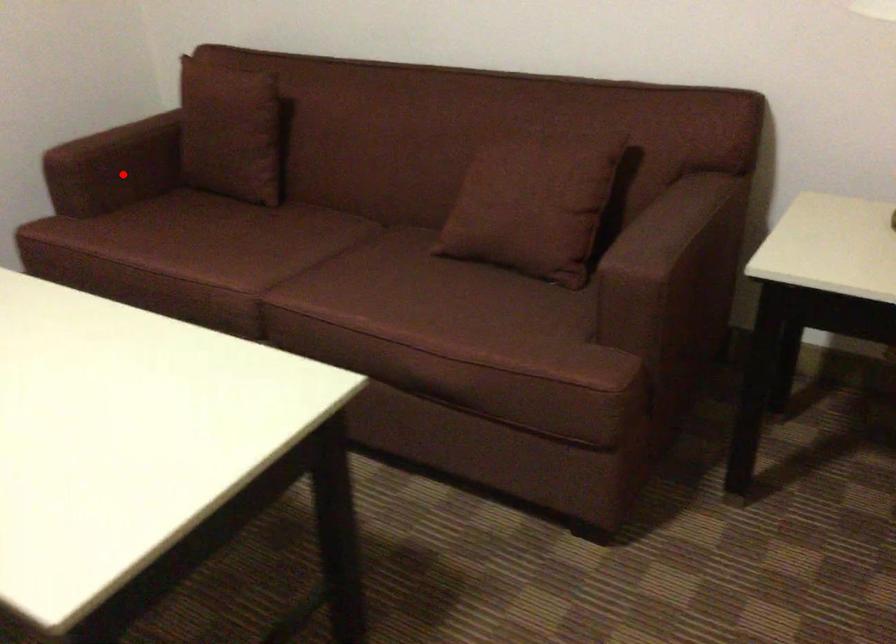
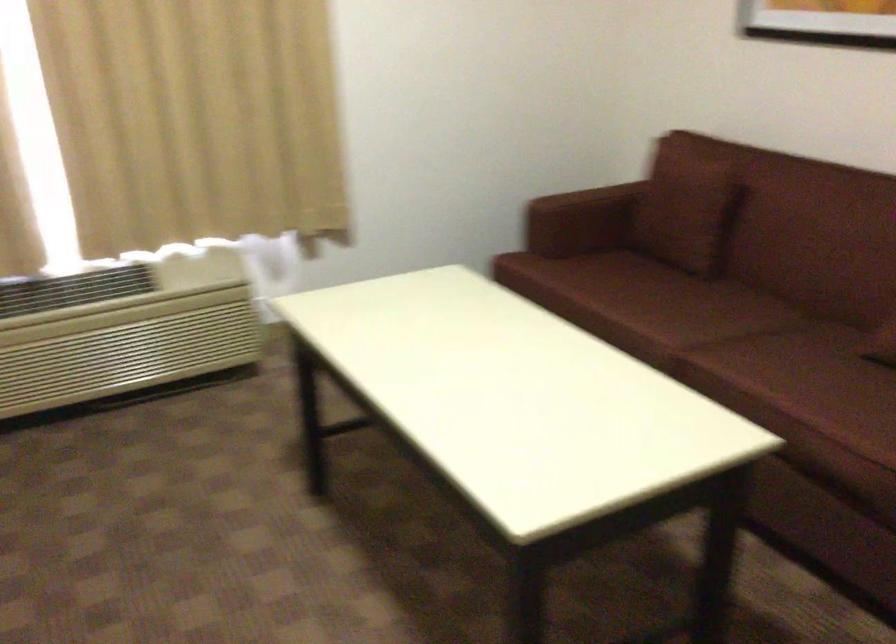
Question: I am providing you with two images of the same scene from different viewpoints. A red point is shown in image1. For the corresponding object point in image2, is it positioned nearer or farther from the camera?

Choices:
 (A) Nearer
 (B) Farther

Answer: (B)